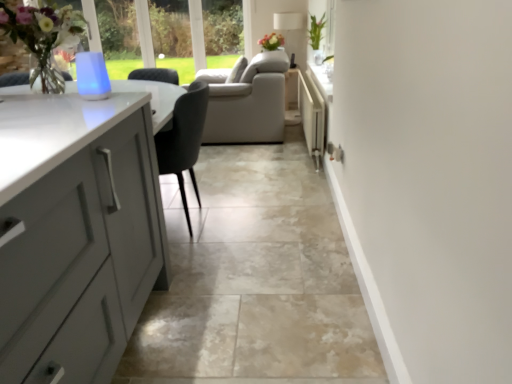
Question: Is matte gray cabinets at left taller than matte floral arrangement at center?

Choices:
 (A) no
 (B) yes

Answer: (A)

Question: Considering the relative sizes of matte gray cabinets at left and matte floral arrangement at center in the image provided, is matte gray cabinets at left shorter than matte floral arrangement at center?

Choices:
 (A) yes
 (B) no

Answer: (A)

Question: Considering the relative positions of matte gray cabinets at left and matte floral arrangement at center in the image provided, is matte gray cabinets at left to the left of matte floral arrangement at center from the viewer's perspective?

Choices:
 (A) yes
 (B) no

Answer: (A)

Question: Considering the relative sizes of matte gray cabinets at left and matte floral arrangement at center in the image provided, is matte gray cabinets at left thinner than matte floral arrangement at center?

Choices:
 (A) yes
 (B) no

Answer: (B)

Question: From a real-world perspective, is matte gray cabinets at left located beneath matte floral arrangement at center?

Choices:
 (A) yes
 (B) no

Answer: (A)

Question: Does matte gray cabinets at left appear on the right side of matte floral arrangement at center?

Choices:
 (A) no
 (B) yes

Answer: (A)

Question: Does matte floral arrangement at center turn towards white plastic radiator at center-right?

Choices:
 (A) no
 (B) yes

Answer: (A)

Question: Is white plastic radiator at center-right inside matte floral arrangement at center?

Choices:
 (A) yes
 (B) no

Answer: (B)

Question: From the image's perspective, is matte floral arrangement at center located above white plastic radiator at center-right?

Choices:
 (A) no
 (B) yes

Answer: (B)

Question: Is matte floral arrangement at center thinner than white plastic radiator at center-right?

Choices:
 (A) yes
 (B) no

Answer: (B)

Question: From the image's perspective, is matte floral arrangement at center below white plastic radiator at center-right?

Choices:
 (A) no
 (B) yes

Answer: (A)

Question: Does matte floral arrangement at center have a lesser height compared to white plastic radiator at center-right?

Choices:
 (A) yes
 (B) no

Answer: (A)

Question: Is green leafy plant at upper right positioned before matte floral arrangement at center?

Choices:
 (A) yes
 (B) no

Answer: (A)